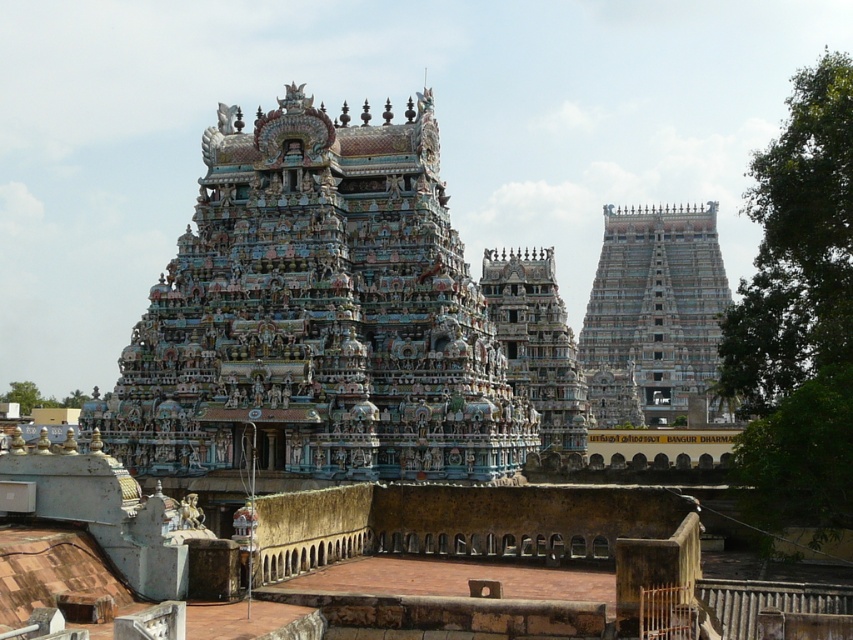
You are an architect visiting the temple complex and want to take a photo of both the blue stone temple at center and the multicolored ornate temple at center. Based on their positions, which temple should you focus on first to capture both in the frame?

The blue stone temple at center is positioned on the right side of the multicolored ornate temple at center, so you should focus on the multicolored ornate temple at center first to ensure both are in the frame.

You are standing at the point labeled point at (418, 150). You want to walk to the nearest temple. Which temple should you go to?

The point labeled point at (418, 150) is 90.20 meters away from the nearest temple. Therefore, you should go to the nearest temple which is 90.20 meters away.

You are standing at the entrance of the temple complex and want to take a photo of the blue stone temple at center. Which direction should you face to ensure the temple is in the center of your camera frame?

Since the blue stone temple at center is located at point coordinates, you should face directly towards the center of the temple complex to capture it in the center of your camera frame.